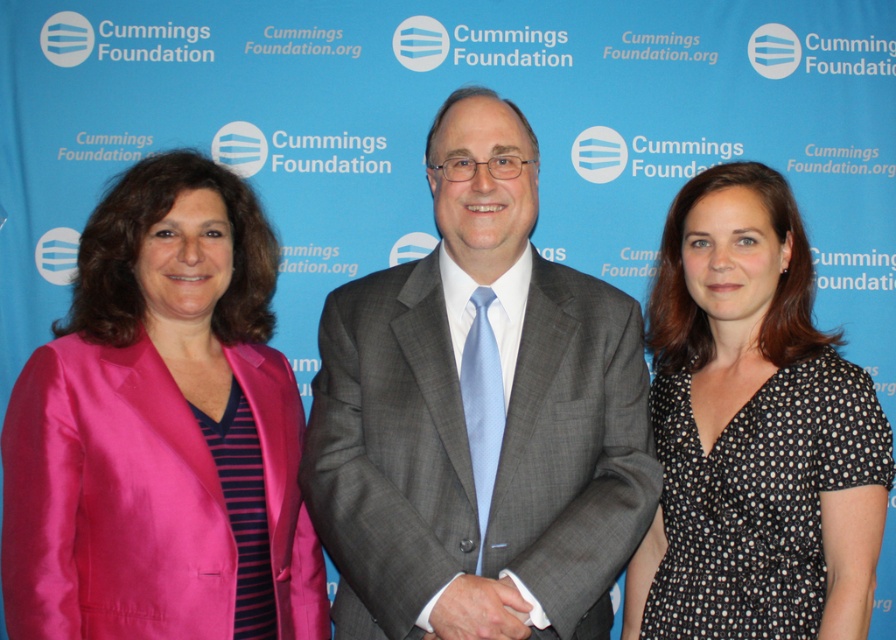
Question: Which of these objects is positioned closest to the satin pink blazer at left?

Choices:
 (A) black dotted dress at center
 (B) gray suit at center
 (C) white satin hand at center

Answer: (B)

Question: Does satin pink blazer at left appear under white satin hand at center?

Choices:
 (A) yes
 (B) no

Answer: (B)

Question: Among these objects, which one is nearest to the camera?

Choices:
 (A) gray suit at center
 (B) white satin hand at center
 (C) black dotted dress at center
 (D) satin pink blazer at left

Answer: (B)

Question: Is black dotted dress at center below white satin hand at center?

Choices:
 (A) yes
 (B) no

Answer: (B)

Question: Does gray suit at center have a lesser width compared to black dotted dress at center?

Choices:
 (A) yes
 (B) no

Answer: (B)

Question: Estimate the real-world distances between objects in this image. Which object is farther from the white satin hand at center?

Choices:
 (A) satin pink blazer at left
 (B) gray suit at center
 (C) black dotted dress at center

Answer: (A)